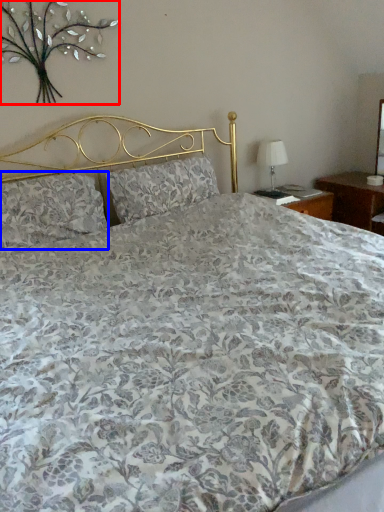
Question: Which object is closer to the camera taking this photo, floral arrangement (highlighted by a red box) or pillow (highlighted by a blue box)?

Choices:
 (A) floral arrangement
 (B) pillow

Answer: (A)